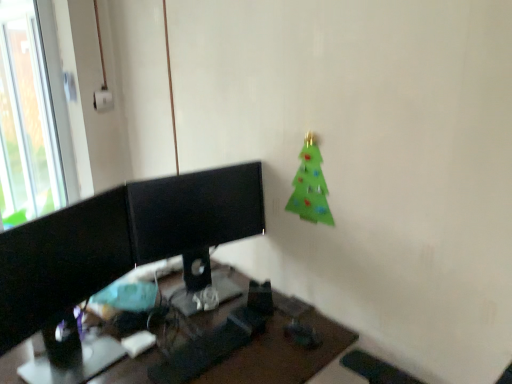
Question: Does transparent glass window at upper left touch black glossy monitor at center?

Choices:
 (A) no
 (B) yes

Answer: (A)

Question: Could you tell me if transparent glass window at upper left is facing black glossy monitor at center?

Choices:
 (A) no
 (B) yes

Answer: (B)

Question: Does transparent glass window at upper left have a lesser height compared to black glossy monitor at center?

Choices:
 (A) yes
 (B) no

Answer: (B)

Question: From a real-world perspective, is transparent glass window at upper left physically below black glossy monitor at center?

Choices:
 (A) no
 (B) yes

Answer: (A)

Question: Is transparent glass window at upper left bigger than black glossy monitor at center?

Choices:
 (A) yes
 (B) no

Answer: (B)

Question: Does transparent glass window at upper left lie behind black glossy monitor at center?

Choices:
 (A) yes
 (B) no

Answer: (A)

Question: Considering the relative sizes of black glossy monitor at left and green felt christmas tree at upper right in the image provided, is black glossy monitor at left wider than green felt christmas tree at upper right?

Choices:
 (A) yes
 (B) no

Answer: (A)

Question: Considering the relative sizes of black glossy monitor at left and green felt christmas tree at upper right in the image provided, is black glossy monitor at left taller than green felt christmas tree at upper right?

Choices:
 (A) no
 (B) yes

Answer: (B)

Question: Considering the relative positions of black glossy monitor at left and green felt christmas tree at upper right in the image provided, is black glossy monitor at left to the right of green felt christmas tree at upper right from the viewer's perspective?

Choices:
 (A) yes
 (B) no

Answer: (B)

Question: Is black glossy monitor at left looking in the opposite direction of green felt christmas tree at upper right?

Choices:
 (A) yes
 (B) no

Answer: (B)

Question: From a real-world perspective, is black glossy monitor at left located beneath green felt christmas tree at upper right?

Choices:
 (A) no
 (B) yes

Answer: (B)

Question: From the image's perspective, would you say black glossy monitor at left is positioned over green felt christmas tree at upper right?

Choices:
 (A) no
 (B) yes

Answer: (A)

Question: Is black plastic desk at center closer to camera compared to black glossy monitor at left?

Choices:
 (A) yes
 (B) no

Answer: (A)